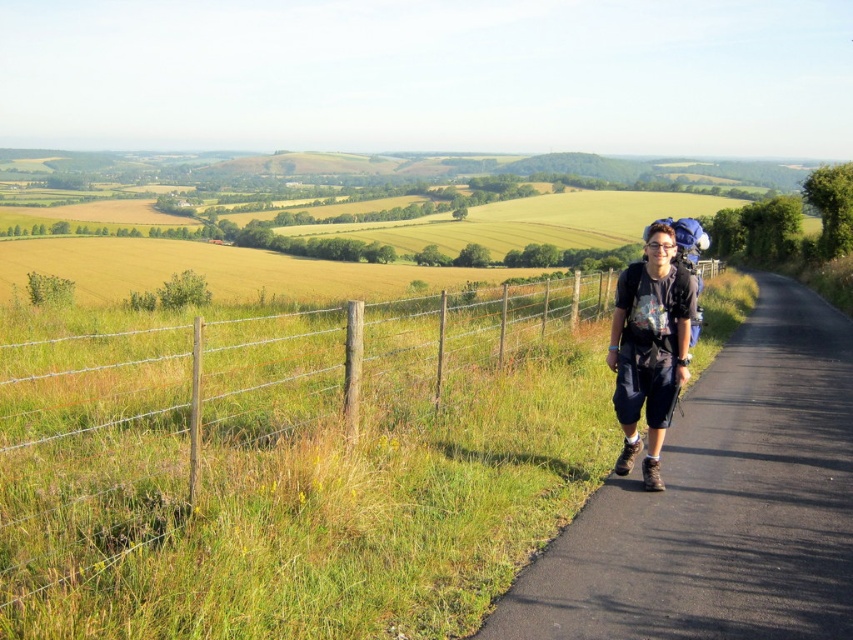
Question: Estimate the real-world distances between objects in this image. Which object is closer to the dark blue fabric backpack at right?

Choices:
 (A) black asphalt road at center-right
 (B) wooden post wire fence at left

Answer: (A)

Question: Does wooden post wire fence at left appear over black asphalt road at center-right?

Choices:
 (A) no
 (B) yes

Answer: (B)

Question: Considering the relative positions of wooden post wire fence at left and black asphalt road at center-right in the image provided, where is wooden post wire fence at left located with respect to black asphalt road at center-right?

Choices:
 (A) above
 (B) below

Answer: (A)

Question: Can you confirm if black asphalt road at center-right is wider than dark blue fabric backpack at right?

Choices:
 (A) yes
 (B) no

Answer: (A)

Question: Which of the following is the farthest from the observer?

Choices:
 (A) (421, 298)
 (B) (674, 372)
 (C) (833, 616)

Answer: (A)

Question: Which point is farther from the camera taking this photo?

Choices:
 (A) (787, 637)
 (B) (135, 621)

Answer: (A)